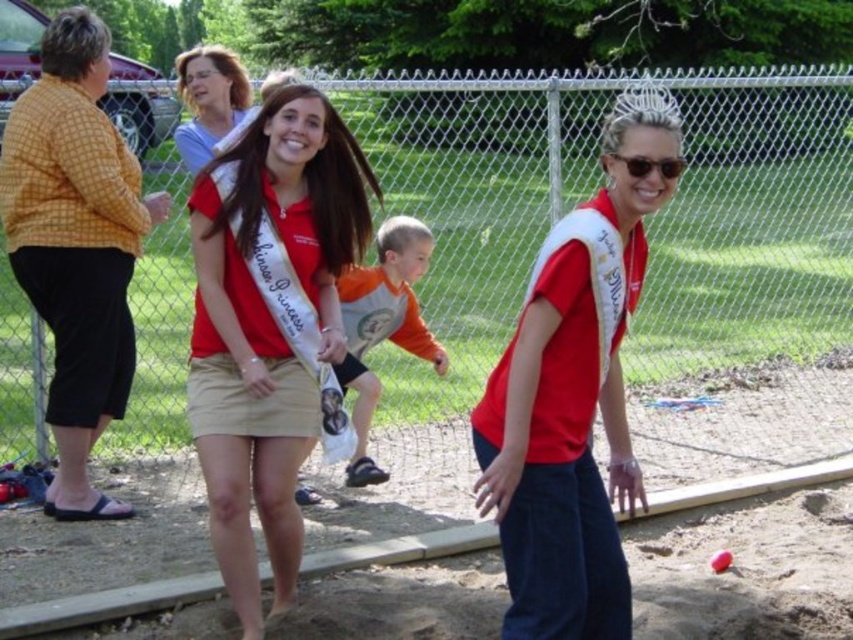
Question: From the image, what is the correct spatial relationship of matte red shirt at center in relation to matte blue shirt at upper left?

Choices:
 (A) left
 (B) right

Answer: (B)

Question: Which object appears closest to the camera in this image?

Choices:
 (A) orange cotton shirt at center
 (B) matte red shirt at center
 (C) matte red sash at center

Answer: (C)

Question: Can you confirm if matte red shirt at center is smaller than orange cotton shirt at center?

Choices:
 (A) yes
 (B) no

Answer: (A)

Question: Which point is farther from the camera taking this photo?

Choices:
 (A) (421, 236)
 (B) (239, 326)
 (C) (218, 90)
 (D) (578, 456)

Answer: (A)

Question: Is matte red sash at center to the left of matte blue shirt at upper left from the viewer's perspective?

Choices:
 (A) yes
 (B) no

Answer: (B)

Question: Among these objects, which one is nearest to the camera?

Choices:
 (A) matte red sash at center
 (B) matte blue shirt at upper left
 (C) orange cotton shirt at center

Answer: (A)